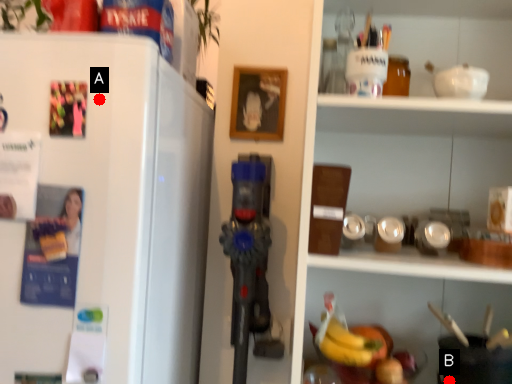
Question: Two points are circled on the image, labeled by A and B beside each circle. Which point appears farthest from the camera in this image?

Choices:
 (A) A is further
 (B) B is further

Answer: (B)